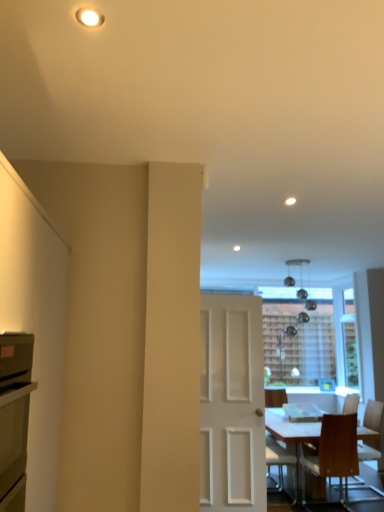
Describe the element at coordinates (14, 417) in the screenshot. I see `matte black oven at left` at that location.

Measure the distance between point (x=205, y=329) and camera.

Point (x=205, y=329) and camera are 4.12 meters apart from each other.

Locate an element on the screen. The height and width of the screenshot is (512, 384). wooden chair at lower right, placed as the 3th chair when sorted from right to left is located at coordinates (280, 462).

The image size is (384, 512). In order to click on wooden chair at lower right, which is the third chair in left-to-right order in this screenshot , I will do `click(351, 404)`.

You are a GUI agent. You are given a task and a screenshot of the screen. Output one action in this format:
    pyautogui.click(x=<x>, y=<y>)
    Task: Click on the door positioned vertically above the wooden chair at lower right, marked as the first chair in a right-to-left arrangement (from a real-world perspective)
    
    Given the screenshot: What is the action you would take?
    pyautogui.click(x=232, y=404)

Which object is wider, wooden chair at lower right, which is the third chair in left-to-right order, or white matte door at center?

With larger width is wooden chair at lower right, which is the third chair in left-to-right order.

From the image's perspective, who appears lower, wooden chair at lower right, marked as the first chair in a right-to-left arrangement, or white matte door at center?

wooden chair at lower right, marked as the first chair in a right-to-left arrangement.

Considering the sizes of objects wooden chair at lower right, which is the third chair in left-to-right order, and white matte door at center in the image provided, who is taller, wooden chair at lower right, which is the third chair in left-to-right order, or white matte door at center?

white matte door at center is taller.

Which is closer, (24, 466) or (236, 445)?

The point (24, 466) is closer to the camera.

Is matte black oven at left positioned with its back to white matte door at center?

No, white matte door at center is not at the back of matte black oven at left.

Is matte black oven at left not inside white matte door at center?

Yes, matte black oven at left is not within white matte door at center.

Based on the photo, is the position of matte black oven at left less distant than that of white matte door at center?

Yes, it is.

Is wooden chair at lower right, which is counted as the 2th chair, starting from the left, wider than white matte door at center?

Indeed, wooden chair at lower right, which is counted as the 2th chair, starting from the left, has a greater width compared to white matte door at center.

Considering the points (351, 428) and (256, 358), which point is behind, point (351, 428) or point (256, 358)?

Point (351, 428)

In the scene shown: Considering the positions of objects wooden chair at lower right, which is counted as the 2th chair, starting from the left, and white matte door at center in the image provided, who is more to the right, wooden chair at lower right, which is counted as the 2th chair, starting from the left, or white matte door at center?

wooden chair at lower right, which is counted as the 2th chair, starting from the left.

Can you tell me how much wooden chair at lower right, which is counted as the 2th chair, starting from the left, and white matte door at center differ in facing direction?

The facing directions of wooden chair at lower right, which is counted as the 2th chair, starting from the left, and white matte door at center are 175 degrees apart.

From a real-world perspective, does wooden chair at lower right, which is the first chair in left-to-right order, sit lower than wooden chair at lower right, positioned as the 2th chair in right-to-left order?

Indeed, from a real-world perspective, wooden chair at lower right, which is the first chair in left-to-right order, is positioned beneath wooden chair at lower right, positioned as the 2th chair in right-to-left order.

Would you say wooden chair at lower right, which is the first chair in left-to-right order, is a long distance from wooden chair at lower right, which is counted as the 2th chair, starting from the left?

That's not correct — wooden chair at lower right, which is the first chair in left-to-right order, is a little close to wooden chair at lower right, which is counted as the 2th chair, starting from the left.

Is wooden chair at lower right, placed as the 3th chair when sorted from right to left, in front of wooden chair at lower right, which is counted as the 2th chair, starting from the left?

No.

Could you measure the distance between wooden chair at lower right, placed as the 3th chair when sorted from right to left, and wooden chair at lower right, which is counted as the 2th chair, starting from the left?

wooden chair at lower right, placed as the 3th chair when sorted from right to left, and wooden chair at lower right, which is counted as the 2th chair, starting from the left, are 36.57 centimeters apart.

How far apart are wooden chair at lower right, which is the third chair in left-to-right order, and wooden chair at lower right, which is the first chair in left-to-right order?

They are 31.11 inches apart.

In the scene shown: Which object is thinner, wooden chair at lower right, which is the third chair in left-to-right order, or wooden chair at lower right, placed as the 3th chair when sorted from right to left?

wooden chair at lower right, placed as the 3th chair when sorted from right to left.

Can you see wooden chair at lower right, marked as the first chair in a right-to-left arrangement, touching wooden chair at lower right, placed as the 3th chair when sorted from right to left?

No, wooden chair at lower right, marked as the first chair in a right-to-left arrangement, is not making contact with wooden chair at lower right, placed as the 3th chair when sorted from right to left.

Can you confirm if wooden chair at lower right, which is the third chair in left-to-right order, is positioned to the right of wooden chair at lower right, which is the first chair in left-to-right order?

Indeed, wooden chair at lower right, which is the third chair in left-to-right order, is positioned on the right side of wooden chair at lower right, which is the first chair in left-to-right order.

Does white matte door at center appear on the right side of wooden chair at lower right, marked as the first chair in a right-to-left arrangement?

In fact, white matte door at center is to the left of wooden chair at lower right, marked as the first chair in a right-to-left arrangement.

Where is `door that is on the left side of wooden chair at lower right, which is the third chair in left-to-right order`? This screenshot has width=384, height=512. door that is on the left side of wooden chair at lower right, which is the third chair in left-to-right order is located at coordinates (232, 404).

Considering the relative sizes of white matte door at center and wooden chair at lower right, which is the third chair in left-to-right order, in the image provided, is white matte door at center taller than wooden chair at lower right, which is the third chair in left-to-right order,?

Correct, white matte door at center is much taller as wooden chair at lower right, which is the third chair in left-to-right order.

How different are the orientations of white matte door at center and wooden chair at lower right, marked as the first chair in a right-to-left arrangement, in degrees?

white matte door at center and wooden chair at lower right, marked as the first chair in a right-to-left arrangement, are facing 86.7 degrees away from each other.

Who is bigger, matte black oven at left or wooden chair at lower right, which is the first chair in left-to-right order?

wooden chair at lower right, which is the first chair in left-to-right order.

Consider the image. Are matte black oven at left and wooden chair at lower right, placed as the 3th chair when sorted from right to left, beside each other?

No.

Is point (12, 436) closer or farther from the camera than point (275, 447)?

Point (12, 436) appears to be closer to the viewer than point (275, 447).

Locate an element on the screen. The height and width of the screenshot is (512, 384). cabinetry located above the wooden chair at lower right, placed as the 3th chair when sorted from right to left (from the image's perspective) is located at coordinates (14, 417).

Identify the location of door on the left of wooden chair at lower right, which is the third chair in left-to-right order. (232, 404).

Identify the location of door below the matte black oven at left (from the image's perspective). (232, 404).

Based on their spatial positions, is white matte door at center or wooden chair at lower right, which is counted as the 2th chair, starting from the left, further from matte black oven at left?

wooden chair at lower right, which is counted as the 2th chair, starting from the left, is further to matte black oven at left.

Looking at the image, which one is located closer to wooden chair at lower right, which is counted as the 2th chair, starting from the left, matte black oven at left or wooden chair at lower right, marked as the first chair in a right-to-left arrangement?

wooden chair at lower right, marked as the first chair in a right-to-left arrangement, is positioned closer to the anchor wooden chair at lower right, which is counted as the 2th chair, starting from the left.

Looking at the image, which one is located further to matte black oven at left, wooden chair at lower right, marked as the first chair in a right-to-left arrangement, or wooden chair at lower right, placed as the 3th chair when sorted from right to left?

Based on the image, wooden chair at lower right, marked as the first chair in a right-to-left arrangement, appears to be further to matte black oven at left.

In the scene shown: Based on their spatial positions, is matte black oven at left or wooden chair at lower right, positioned as the 2th chair in right-to-left order, closer to wooden chair at lower right, which is the first chair in left-to-right order?

wooden chair at lower right, positioned as the 2th chair in right-to-left order, is positioned closer to the anchor wooden chair at lower right, which is the first chair in left-to-right order.

Based on their spatial positions, is matte black oven at left or wooden chair at lower right, which is the third chair in left-to-right order, further from white matte door at center?

The object further to white matte door at center is matte black oven at left.

When comparing their distances from wooden chair at lower right, which is the first chair in left-to-right order, does wooden chair at lower right, marked as the first chair in a right-to-left arrangement, or white matte door at center seem further?

Based on the image, wooden chair at lower right, marked as the first chair in a right-to-left arrangement, appears to be further to wooden chair at lower right, which is the first chair in left-to-right order.

When comparing their distances from wooden chair at lower right, positioned as the 2th chair in right-to-left order, does white matte door at center or wooden chair at lower right, marked as the first chair in a right-to-left arrangement, seem further?

white matte door at center is positioned further to the anchor wooden chair at lower right, positioned as the 2th chair in right-to-left order.

Estimate the real-world distances between objects in this image. Which object is further from wooden chair at lower right, placed as the 3th chair when sorted from right to left, wooden chair at lower right, positioned as the 2th chair in right-to-left order, or wooden chair at lower right, which is the third chair in left-to-right order?

wooden chair at lower right, which is the third chair in left-to-right order, lies further to wooden chair at lower right, placed as the 3th chair when sorted from right to left, than the other object.

At what (x,y) coordinates should I click in order to perform the action: click on door between matte black oven at left and wooden chair at lower right, which is counted as the 2th chair, starting from the left, from front to back. Please return your answer as a coordinate pair (x, y). This screenshot has height=512, width=384. Looking at the image, I should click on (232, 404).

This screenshot has width=384, height=512. I want to click on chair between matte black oven at left and wooden chair at lower right, placed as the 3th chair when sorted from right to left, along the z-axis, so click(333, 451).

Find the location of a particular element. The height and width of the screenshot is (512, 384). door located between matte black oven at left and wooden chair at lower right, placed as the 3th chair when sorted from right to left, in the depth direction is located at coordinates (232, 404).

Identify the location of chair between wooden chair at lower right, which is the first chair in left-to-right order, and wooden chair at lower right, marked as the first chair in a right-to-left arrangement. This screenshot has height=512, width=384. (333, 451).